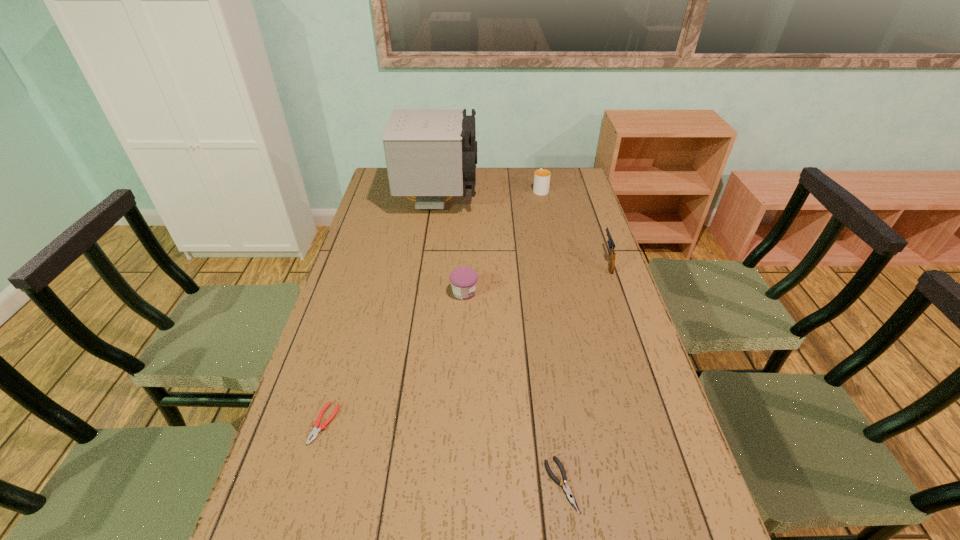
Where is `fan located at the far edge`? This screenshot has width=960, height=540. fan located at the far edge is located at coordinates (430, 154).

This screenshot has height=540, width=960. Identify the location of cup at the far edge. (541, 177).

The width and height of the screenshot is (960, 540). Identify the location of fan that is at the left edge. pyautogui.click(x=430, y=154).

Where is `pliers located in the left edge section of the desktop`? The height and width of the screenshot is (540, 960). pliers located in the left edge section of the desktop is located at coordinates (315, 431).

Where is `gun present at the right edge`? gun present at the right edge is located at coordinates (611, 244).

This screenshot has width=960, height=540. I want to click on cup situated at the right edge, so click(x=541, y=177).

The width and height of the screenshot is (960, 540). Find the location of `object located at the far left corner`. object located at the far left corner is located at coordinates (430, 154).

Find the location of a particular element. object that is positioned at the far right corner is located at coordinates (541, 177).

Identify the location of vacant space at the far edge of the desktop. click(527, 176).

Image resolution: width=960 pixels, height=540 pixels. I want to click on vacant space at the left edge of the desktop, so [394, 206].